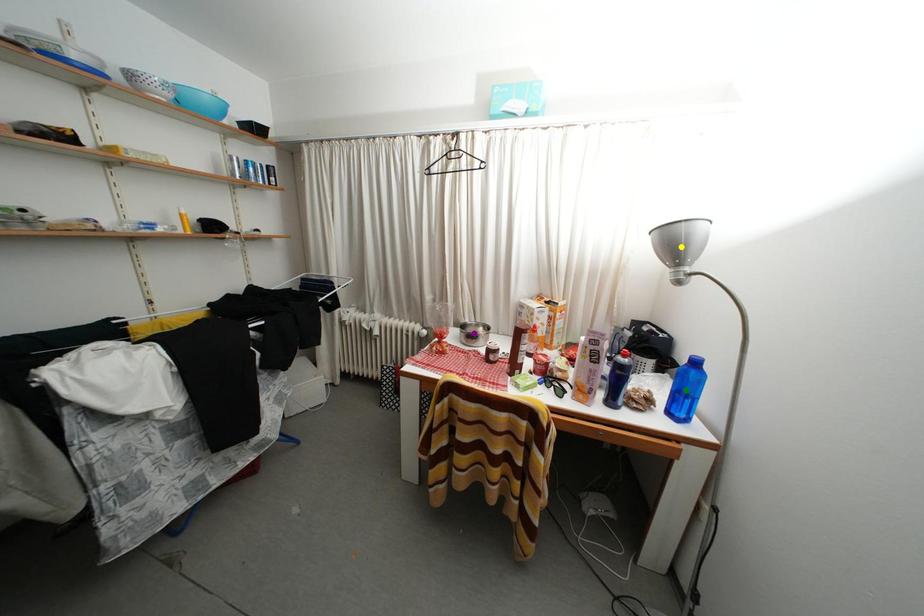
Order these from farthest to nearest:
- green point
- yellow point
- purple point

1. purple point
2. green point
3. yellow point